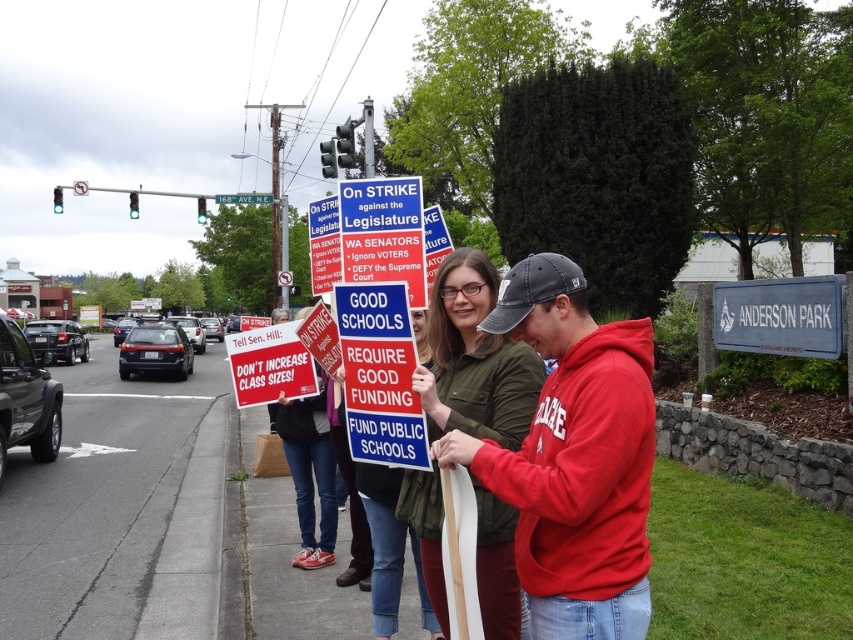
Question: Which is nearer to the gray wooden sign at right?

Choices:
 (A) green fabric jacket at center
 (B) metallic blue street sign at upper center

Answer: (A)

Question: Is green fabric jacket at center positioned before metallic blue street sign at upper center?

Choices:
 (A) yes
 (B) no

Answer: (A)

Question: Is gray wooden sign at right below metallic blue street sign at upper center?

Choices:
 (A) yes
 (B) no

Answer: (A)

Question: Does gray wooden sign at right appear under red plastic sign at center?

Choices:
 (A) yes
 (B) no

Answer: (B)

Question: Which object is the closest to the gray wooden sign at right?

Choices:
 (A) metallic blue street sign at upper center
 (B) red plastic sign at center
 (C) green fabric jacket at center

Answer: (B)

Question: Which object is the farthest from the gray wooden sign at right?

Choices:
 (A) green fabric jacket at center
 (B) denim pants at lower center
 (C) red fleece hoodie at center

Answer: (C)